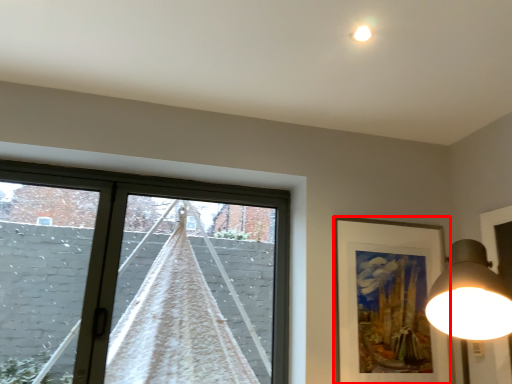
Question: In this image, where is picture frame (annotated by the red box) located relative to curtain?

Choices:
 (A) right
 (B) left

Answer: (A)